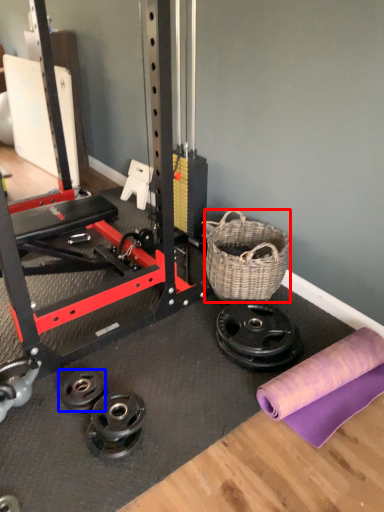
Question: Which point is further to the camera, basket (highlighted by a red box) or wheel (highlighted by a blue box)?

Choices:
 (A) basket
 (B) wheel

Answer: (A)